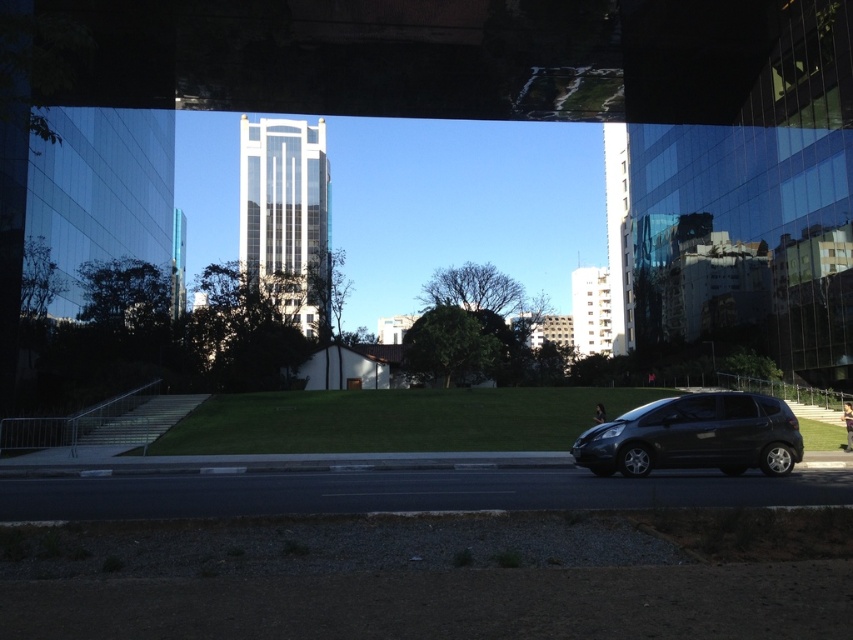
Is clear glass tower at center positioned in front of shiny black hatchback at center?

No, clear glass tower at center is behind shiny black hatchback at center.

In the scene shown: Is clear glass tower at center to the right of shiny black hatchback at center from the viewer's perspective?

In fact, clear glass tower at center is to the left of shiny black hatchback at center.

The height and width of the screenshot is (640, 853). Describe the element at coordinates (285, 209) in the screenshot. I see `clear glass tower at center` at that location.

Where is `clear glass tower at center`? This screenshot has height=640, width=853. clear glass tower at center is located at coordinates (285, 209).